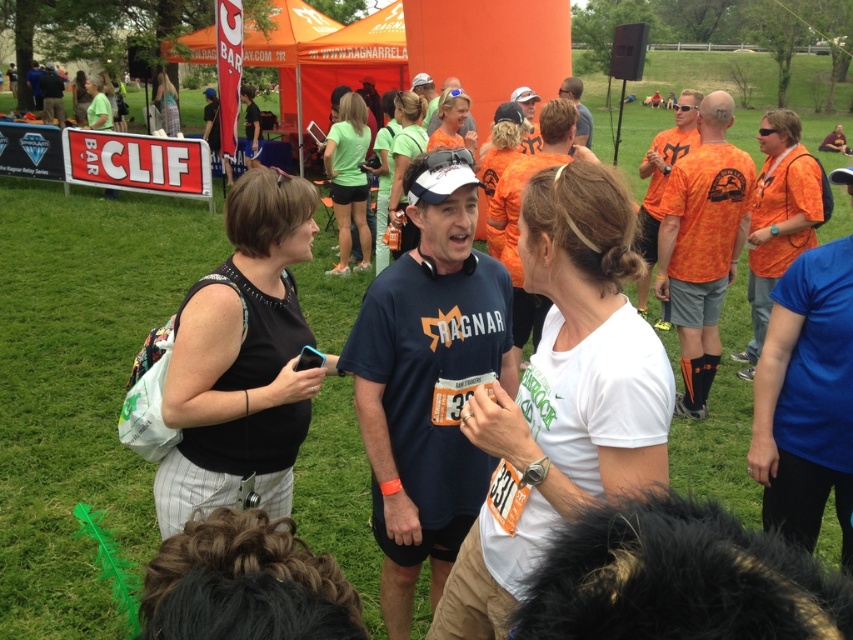
You are a photographer at the event and want to capture a photo of both the green fabric shorts at center and the matte orange shirt at center. Since you can only focus on one subject at a time, which one should you focus on first to ensure both are in frame?

You should focus on the matte orange shirt at center first because the green fabric shorts at center are to the left of it, so by centering the matte orange shirt at center, the green fabric shorts at center will naturally be included in the frame to its left.